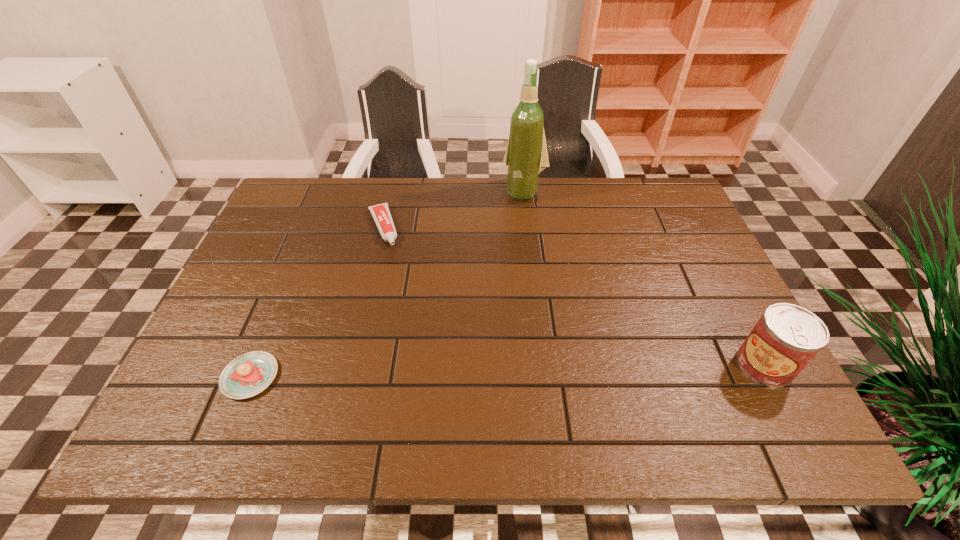
I want to click on vacant area situated at the nozzle of the third nearest object, so click(408, 312).

This screenshot has height=540, width=960. What are the coordinates of `free region located 0.120m at the nozzle of the third nearest object` in the screenshot? It's located at (396, 278).

The image size is (960, 540). What are the coordinates of `free space located 0.160m on the front-facing side of the wine bottle` in the screenshot? It's located at (502, 237).

This screenshot has width=960, height=540. I want to click on vacant space situated 0.370m on the front-facing side of the wine bottle, so click(x=475, y=289).

You are a GUI agent. You are given a task and a screenshot of the screen. Output one action in this format:
    pyautogui.click(x=<x>, y=<y>)
    Task: Click on the vacant space located on the front-facing side of the wine bottle
    Image resolution: width=960 pixels, height=540 pixels.
    Given the screenshot: What is the action you would take?
    pyautogui.click(x=484, y=273)

Find the location of a particular element. This screenshot has width=960, height=540. toothpaste that is at the far edge is located at coordinates (381, 214).

Locate an element on the screen. This screenshot has height=540, width=960. wine bottle that is positioned at the far edge is located at coordinates (526, 155).

Where is `pastry at the near edge`? pastry at the near edge is located at coordinates (249, 374).

The image size is (960, 540). I want to click on can located at the near edge, so click(x=787, y=337).

I want to click on object that is at the left edge, so click(x=249, y=374).